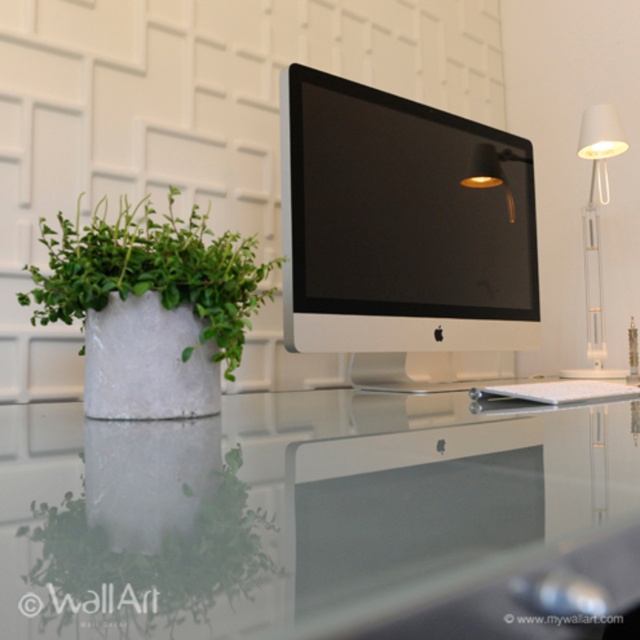
Consider the image. You are organizing a photoshoot for a tech blog and need to ensure the green leafy plant at left and the green concrete pot at left are positioned correctly. Based on their sizes, which object should be placed closer to the camera to make them appear the same height in the photo?

The green leafy plant at left should be placed closer to the camera since it is shorter than the green concrete pot at left. By positioning the shorter plant nearer, they will appear similar in height in the photo.

You are organizing a small event and need to place a 15 cm tall vase on the desk. The vase must be placed between the transparent glass table at center and the green leafy plant at left. Considering their heights, which object should the vase be placed closer to?

The vase should be placed closer to the transparent glass table at center because it is taller than the green leafy plant at left, ensuring better visibility and stability.

You are organizing a desk and want to place a 12 inch wide decorative item between the sleek silver monitor at center and the green concrete pot at left. Will there be enough space for it?

The distance between the sleek silver monitor at center and the green concrete pot at left is 13.71 inches, so yes, a 12 inch wide decorative item will fit between them.